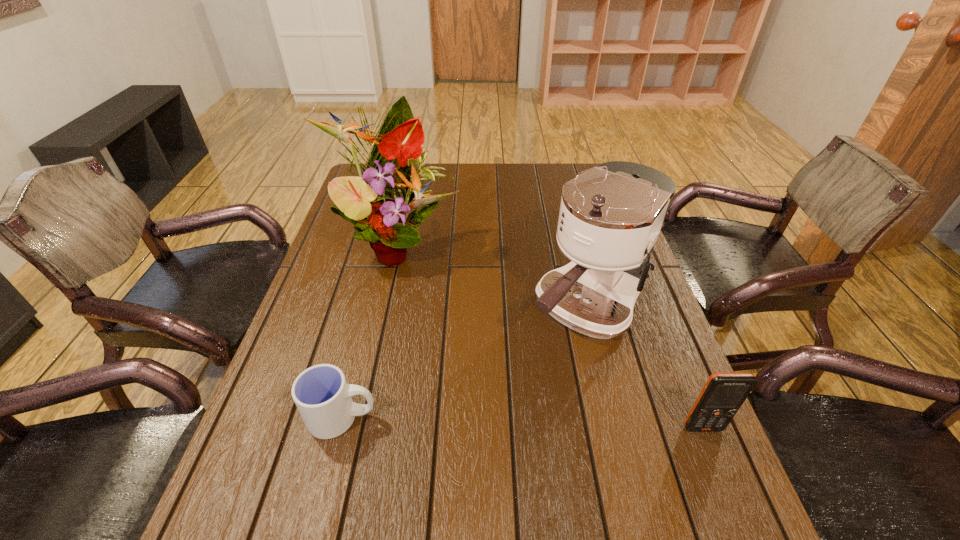
This screenshot has width=960, height=540. In the image, there is a desktop. In order to click on free space at the far right corner in this screenshot , I will do `click(582, 171)`.

I want to click on blank space at the near right corner, so click(688, 471).

At what (x,y) coordinates should I click in order to perform the action: click on blank region between the bouquet and the cellular telephone. Please return your answer as a coordinate pair (x, y). The image size is (960, 540). Looking at the image, I should click on (x=550, y=335).

Image resolution: width=960 pixels, height=540 pixels. In order to click on empty location between the bouquet and the cup in this screenshot , I will do `click(370, 330)`.

Locate an element on the screen. This screenshot has width=960, height=540. vacant space that's between the coffee maker and the bouquet is located at coordinates (492, 275).

Where is `free space between the cup and the bouquet`? The image size is (960, 540). free space between the cup and the bouquet is located at coordinates (370, 330).

Identify the location of unoccupied position between the cellular telephone and the coffee maker. (645, 368).

At what (x,y) coordinates should I click in order to perform the action: click on free space between the coffee maker and the cup. Please return your answer as a coordinate pair (x, y). Image resolution: width=960 pixels, height=540 pixels. Looking at the image, I should click on (465, 363).

This screenshot has width=960, height=540. What are the coordinates of `vacant region between the cup and the coffee maker` in the screenshot? It's located at (465, 363).

Find the location of a particular element. Image resolution: width=960 pixels, height=540 pixels. unoccupied area between the third tallest object and the bouquet is located at coordinates (550, 335).